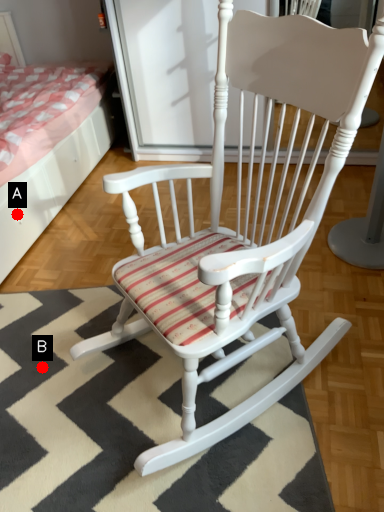
Question: Two points are circled on the image, labeled by A and B beside each circle. Which point is farther to the camera?

Choices:
 (A) A is further
 (B) B is further

Answer: (A)